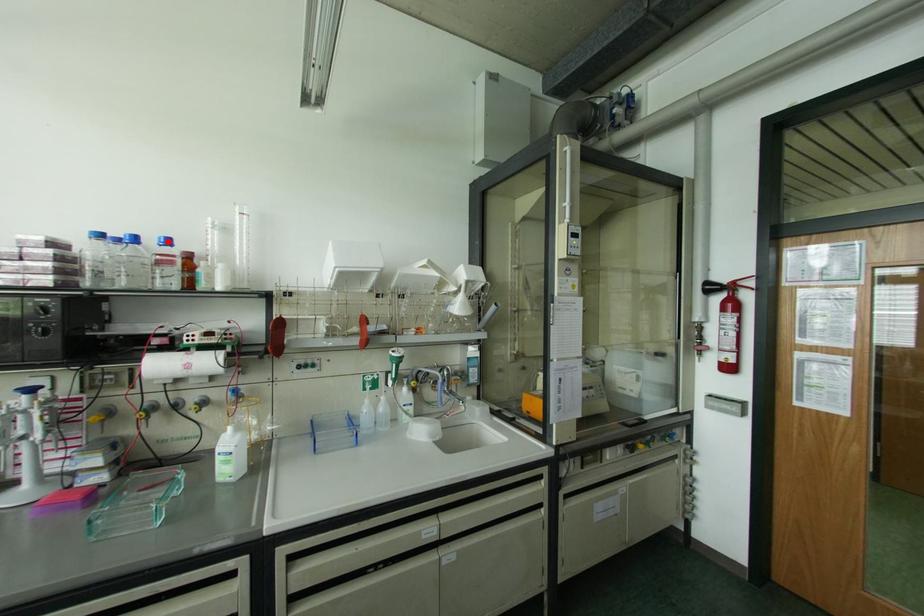
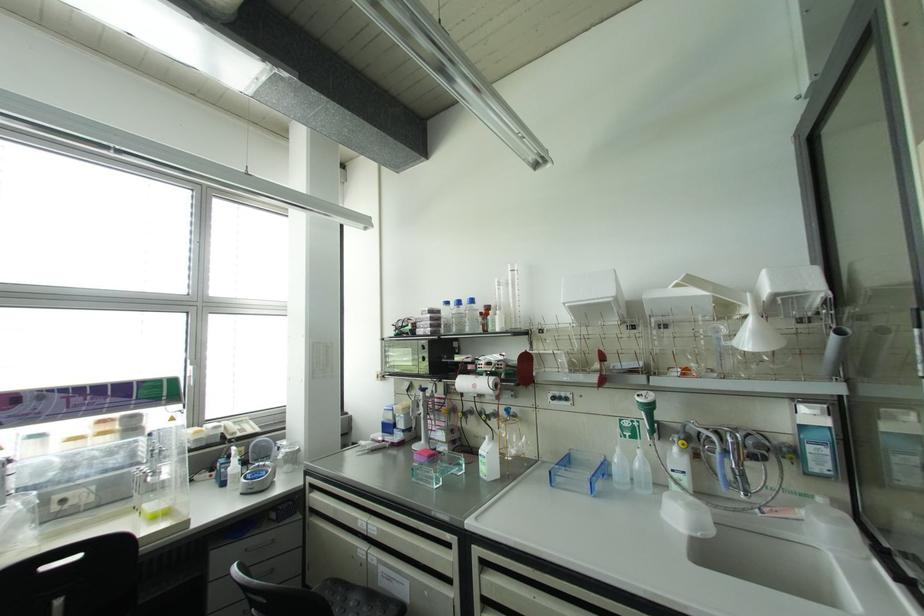
Question: I am providing you with two images of the same scene from different viewpoints. A red point is marked on the first image. Is the red point's position out of view in image 2?

Choices:
 (A) Yes
 (B) No

Answer: (B)